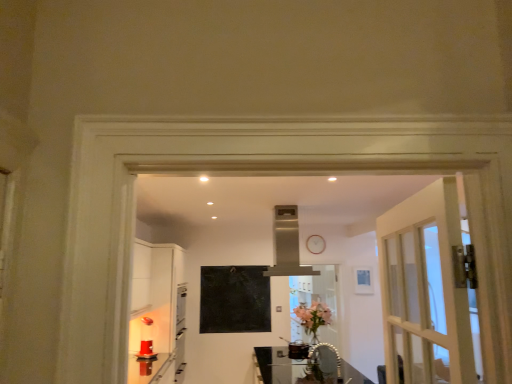
The height and width of the screenshot is (384, 512). Identify the location of clear glass screen door at center. (318, 323).

Find the location of a particular element. The height and width of the screenshot is (384, 512). matte black bulletin board at center is located at coordinates (234, 299).

Image resolution: width=512 pixels, height=384 pixels. Find the location of `clear glass screen door at center`. clear glass screen door at center is located at coordinates (318, 323).

Considering the relative positions of satin silver exhaust hood at center and clear glass screen door at center in the image provided, is satin silver exhaust hood at center to the left of clear glass screen door at center from the viewer's perspective?

Yes, satin silver exhaust hood at center is to the left of clear glass screen door at center.

Locate an element on the screen. exhaust hood that is above the clear glass screen door at center (from the image's perspective) is located at coordinates (287, 244).

Would you say satin silver exhaust hood at center is a long distance from clear glass screen door at center?

Yes, satin silver exhaust hood at center and clear glass screen door at center are quite far apart.

Is matte black bulletin board at center inside the boundaries of satin silver exhaust hood at center, or outside?

matte black bulletin board at center is located beyond the bounds of satin silver exhaust hood at center.

From a real-world perspective, is matte black bulletin board at center under satin silver exhaust hood at center?

Result: Correct, in the physical world, matte black bulletin board at center is lower than satin silver exhaust hood at center.

How different are the orientations of matte black bulletin board at center and satin silver exhaust hood at center in degrees?

The angular difference between matte black bulletin board at center and satin silver exhaust hood at center is 90.8 degrees.

In terms of height, does matte black bulletin board at center look taller or shorter compared to satin silver exhaust hood at center?

Clearly, matte black bulletin board at center is taller compared to satin silver exhaust hood at center.

Is satin silver exhaust hood at center oriented towards clear glass table at center?

No, satin silver exhaust hood at center is not aimed at clear glass table at center.

In the scene shown: From a real-world perspective, is satin silver exhaust hood at center beneath clear glass table at center?

No, from a real-world perspective, satin silver exhaust hood at center is not beneath clear glass table at center.

Can you confirm if satin silver exhaust hood at center is thinner than clear glass table at center?

Yes.

Is clear glass table at center bigger than clear glass screen door at center?

Correct, clear glass table at center is larger in size than clear glass screen door at center.

Considering the sizes of objects clear glass table at center and clear glass screen door at center in the image provided, who is thinner, clear glass table at center or clear glass screen door at center?

clear glass screen door at center is thinner.

Which is behind, clear glass table at center or clear glass screen door at center?

clear glass screen door at center is behind.

Is clear glass table at center facing away from clear glass screen door at center?

No.

From the image's perspective, which one is positioned lower, clear glass table at center or satin silver exhaust hood at center?

clear glass table at center is shown below in the image.

Which of these two, clear glass table at center or satin silver exhaust hood at center, is bigger?

With larger size is clear glass table at center.

Considering the positions of objects clear glass table at center and satin silver exhaust hood at center in the image provided, who is in front, clear glass table at center or satin silver exhaust hood at center?

Positioned in front is clear glass table at center.

Considering the points (350, 367) and (289, 225), which point is behind, point (350, 367) or point (289, 225)?

The point (350, 367) is farther from the camera.

Does clear glass screen door at center have a greater height compared to satin silver exhaust hood at center?

Yes.

Between clear glass screen door at center and satin silver exhaust hood at center, which one appears on the left side from the viewer's perspective?

Positioned to the left is satin silver exhaust hood at center.

Does clear glass screen door at center lie in front of satin silver exhaust hood at center?

No, it is not.

Is clear glass table at center next to pink glass vase at center and touching it?

They are not placed beside each other.

Based on the photo, is clear glass table at center turned away from pink glass vase at center?

No, pink glass vase at center is not at the back of clear glass table at center.

How much distance is there between clear glass table at center and pink glass vase at center?

clear glass table at center is 33.99 inches from pink glass vase at center.

From a real-world perspective, which is physically below, clear glass table at center or pink glass vase at center?

clear glass table at center, from a real-world perspective.

Where is `exhaust hood on the left of the clear glass screen door at center`? exhaust hood on the left of the clear glass screen door at center is located at coordinates (287, 244).

Find the location of a particular element. bulletin board that appears below the satin silver exhaust hood at center (from a real-world perspective) is located at coordinates (234, 299).

Looking at the image, which one is located closer to clear glass screen door at center, satin silver exhaust hood at center or clear glass table at center?

clear glass table at center.

From the image, which object appears to be farther from pink glass vase at center, matte black bulletin board at center or clear glass table at center?

matte black bulletin board at center lies further to pink glass vase at center than the other object.

Which object lies nearer to the anchor point clear glass table at center, matte black bulletin board at center or satin silver exhaust hood at center?

matte black bulletin board at center lies closer to clear glass table at center than the other object.

Based on their spatial positions, is matte black bulletin board at center or clear glass screen door at center further from clear glass table at center?

matte black bulletin board at center is further to clear glass table at center.

From the image, which object appears to be farther from pink glass vase at center, satin silver exhaust hood at center or clear glass screen door at center?

The object further to pink glass vase at center is satin silver exhaust hood at center.

Looking at the image, which one is located further to satin silver exhaust hood at center, matte black bulletin board at center or clear glass screen door at center?

clear glass screen door at center lies further to satin silver exhaust hood at center than the other object.

Estimate the real-world distances between objects in this image. Which object is closer to satin silver exhaust hood at center, clear glass table at center or clear glass screen door at center?

Based on the image, clear glass table at center appears to be nearer to satin silver exhaust hood at center.

Estimate the real-world distances between objects in this image. Which object is closer to clear glass screen door at center, satin silver exhaust hood at center or pink glass vase at center?

pink glass vase at center lies closer to clear glass screen door at center than the other object.

This screenshot has width=512, height=384. I want to click on screen door between pink glass vase at center and matte black bulletin board at center from front to back, so click(318, 323).

Identify the location of flower between clear glass table at center and clear glass screen door at center in the front-back direction. (313, 316).

Locate an element on the screen. Image resolution: width=512 pixels, height=384 pixels. exhaust hood between clear glass table at center and clear glass screen door at center along the z-axis is located at coordinates (287, 244).

At what (x,y) coordinates should I click in order to perform the action: click on exhaust hood between clear glass table at center and matte black bulletin board at center in the front-back direction. Please return your answer as a coordinate pair (x, y). Looking at the image, I should click on (287, 244).